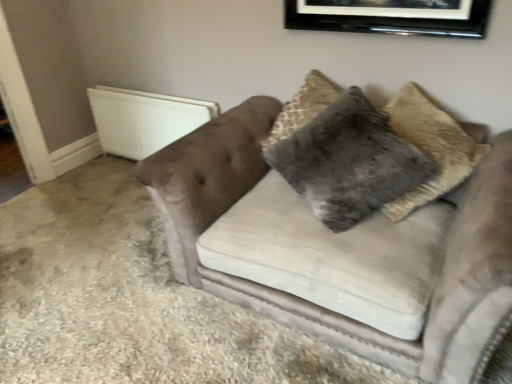
Locate an element on the screen. This screenshot has width=512, height=384. free space above white plastic radiator at left (from a real-world perspective) is located at coordinates (155, 99).